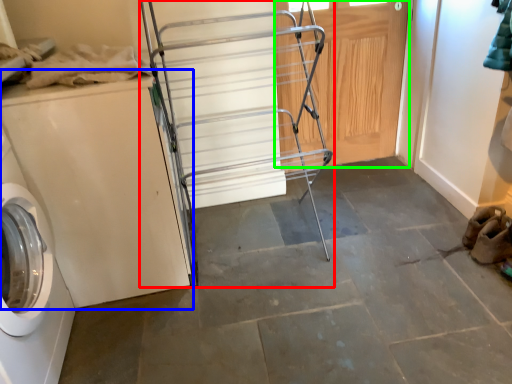
Question: Based on their relative distances, which object is nearer to cart (highlighted by a red box)? Choose from washing machine (highlighted by a blue box) and door (highlighted by a green box).

Choices:
 (A) washing machine
 (B) door

Answer: (B)